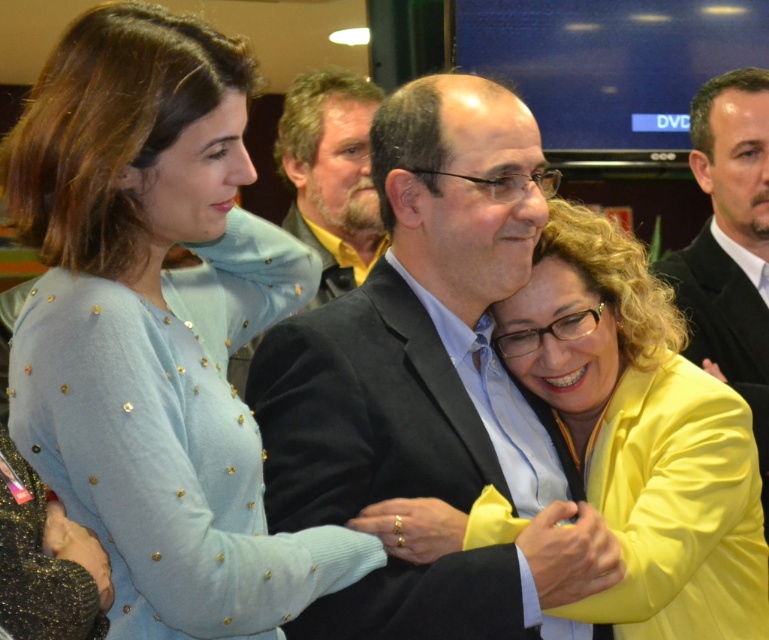
Consider the image. You are a photographer at this event and need to adjust the lighting. The light blue knit sweater at upper left and the bearded man at center are both in your frame. If your camera has a maximum focus range of 3 feet, can you focus on both subjects simultaneously?

The distance between the light blue knit sweater at upper left and the bearded man at center is 3.60 feet. Since the camera can only focus within 3 feet, the subjects are too far apart for simultaneous focus.

You are organizing a photo shoot and need to ensure that all participants are visible in the group photo. The matte black suit at center and the bearded man at center are standing close to each other. Considering their sizes, which one might you position closer to the front to ensure both are fully visible?

The bearded man at center is smaller in size compared to the matte black suit at center, so positioning the bearded man at center closer to the front would help ensure both are fully visible.